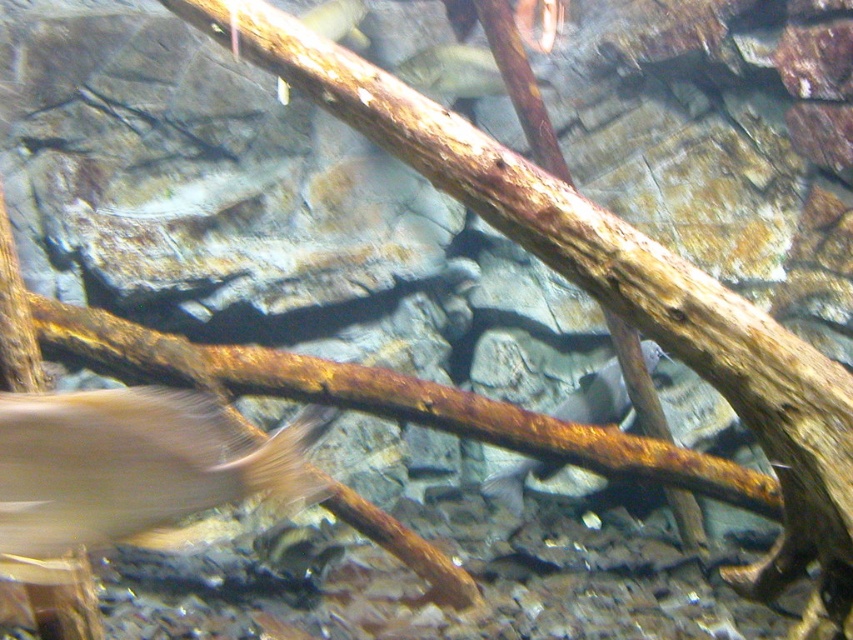
Question: Is silvery metallic fish at center positioned in front of translucent white fish at center?

Choices:
 (A) no
 (B) yes

Answer: (B)

Question: Which object is closer to the camera taking this photo?

Choices:
 (A) silvery metallic fish at center
 (B) translucent white fish at lower left
 (C) translucent white fish at center

Answer: (B)

Question: Which of the following is the farthest from the observer?

Choices:
 (A) (660, 356)
 (B) (13, 528)
 (C) (450, 58)

Answer: (C)

Question: Is translucent white fish at lower left to the right of translucent white fish at center from the viewer's perspective?

Choices:
 (A) no
 (B) yes

Answer: (A)

Question: Which object appears closest to the camera in this image?

Choices:
 (A) translucent white fish at lower left
 (B) silvery metallic fish at center

Answer: (A)

Question: Can you confirm if silvery metallic fish at center is bigger than translucent white fish at center?

Choices:
 (A) no
 (B) yes

Answer: (B)